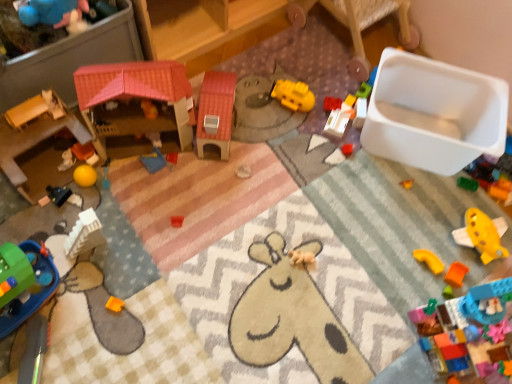
Find the location of a particular element. Image resolution: width=512 pixels, height=384 pixels. unoccupied region to the right of white plastic container at center, acting as the 10th toy starting from the left is located at coordinates (362, 142).